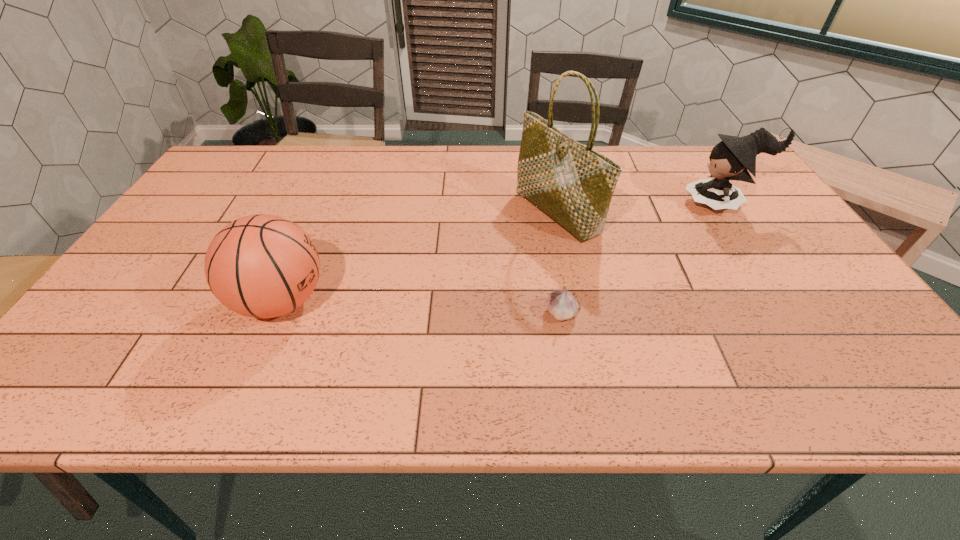
You are a GUI agent. You are given a task and a screenshot of the screen. Output one action in this format:
    pyautogui.click(x=<x>, y=<y>)
    Task: Click on the shopping bag
    Image resolution: width=960 pixels, height=540 pixels.
    Given the screenshot: What is the action you would take?
    pyautogui.click(x=573, y=184)

What are the coordinates of `doll` in the screenshot? It's located at (731, 159).

At what (x,y) coordinates should I click in order to perform the action: click on the leftmost object. Please return your answer as a coordinate pair (x, y). Looking at the image, I should click on (262, 266).

Locate an element on the screen. This screenshot has height=540, width=960. garlic is located at coordinates 561,304.

Find the location of a particular element. This screenshot has width=960, height=540. free space located 0.160m on the front of the tallest object is located at coordinates (573, 291).

Where is `vacant space located 0.060m at the face of the doll`? The height and width of the screenshot is (540, 960). vacant space located 0.060m at the face of the doll is located at coordinates (664, 204).

The image size is (960, 540). I want to click on vacant space located at the face of the doll, so click(x=658, y=204).

The image size is (960, 540). Find the location of `vacant space located at the face of the doll`. vacant space located at the face of the doll is located at coordinates (631, 204).

Where is `free space located 0.190m on the surface of the leftmost object near the brand logo`? This screenshot has height=540, width=960. free space located 0.190m on the surface of the leftmost object near the brand logo is located at coordinates (409, 301).

Find the location of a particular element. This screenshot has width=960, height=540. vacant space located on the right of the garlic is located at coordinates (719, 312).